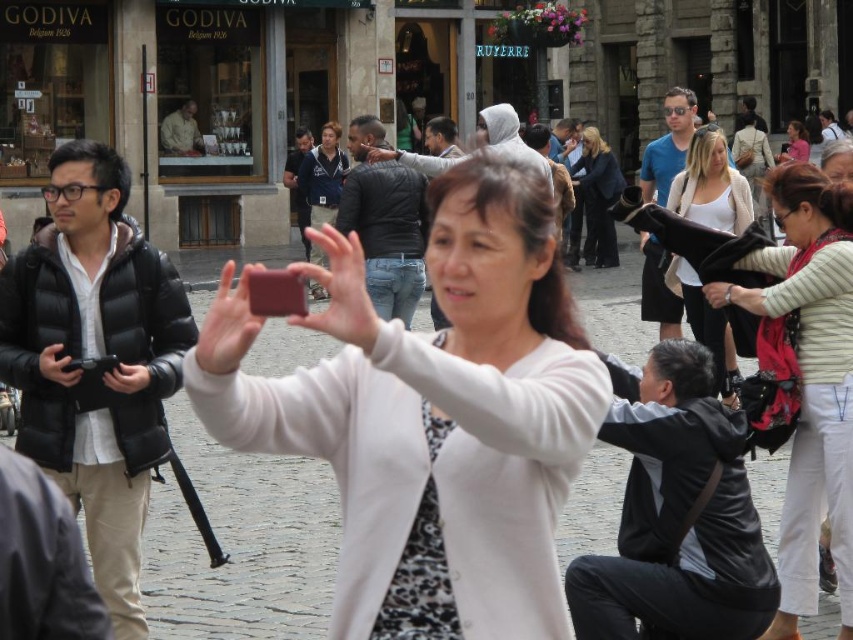
Question: Which point is farther from the camera taking this photo?

Choices:
 (A) (300, 268)
 (B) (822, 298)

Answer: (B)

Question: Is white textured sweater at center bigger than smooth red phone at center?

Choices:
 (A) no
 (B) yes

Answer: (B)

Question: Is striped sweater at center above black matte phone at center-left?

Choices:
 (A) yes
 (B) no

Answer: (A)

Question: Does matte pink phone at center have a lesser width compared to pink fabric at center?

Choices:
 (A) no
 (B) yes

Answer: (A)

Question: Among these points, which one is nearest to the camera?

Choices:
 (A) (788, 129)
 (B) (207, 346)
 (C) (666, 268)

Answer: (B)

Question: Which object appears closest to the camera in this image?

Choices:
 (A) matte pink phone at center
 (B) white textured sweater at center
 (C) white matte jacket at center

Answer: (A)